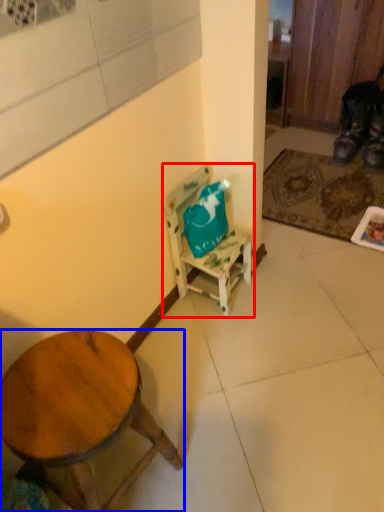
Question: Which of the following is the closest to the observer, chair (highlighted by a red box) or desk (highlighted by a blue box)?

Choices:
 (A) chair
 (B) desk

Answer: (B)